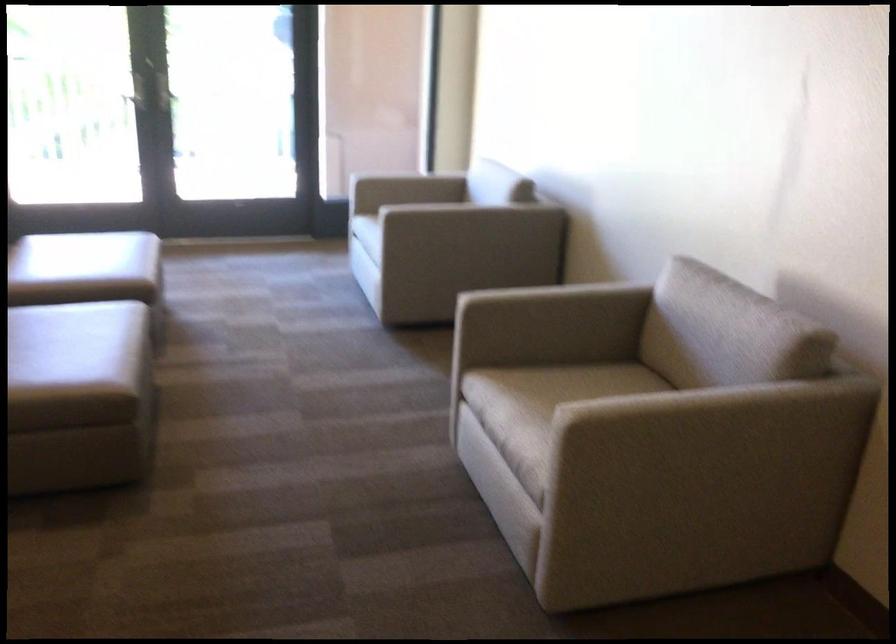
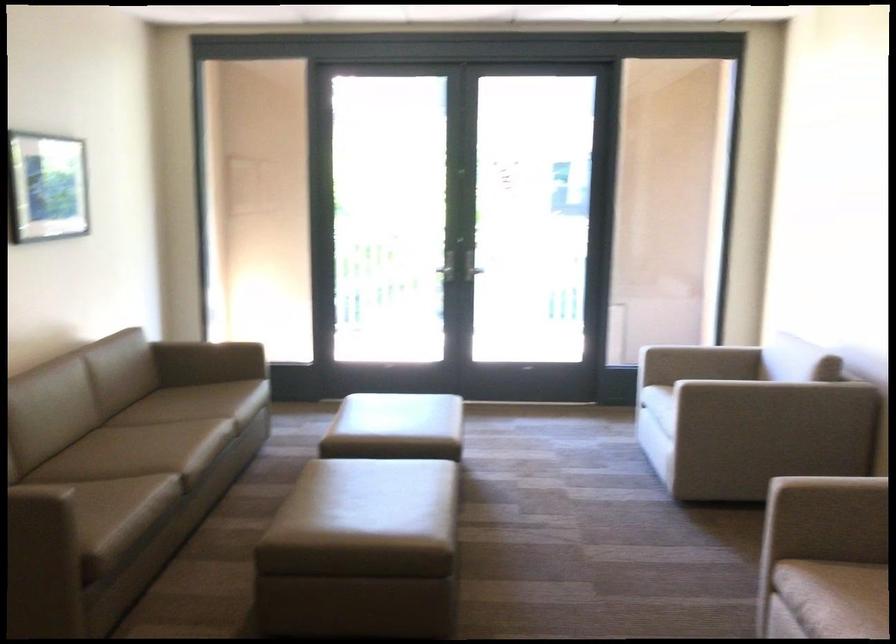
Where in the second image is the point corresponding to pixel 464 166 from the first image?

(762, 346)